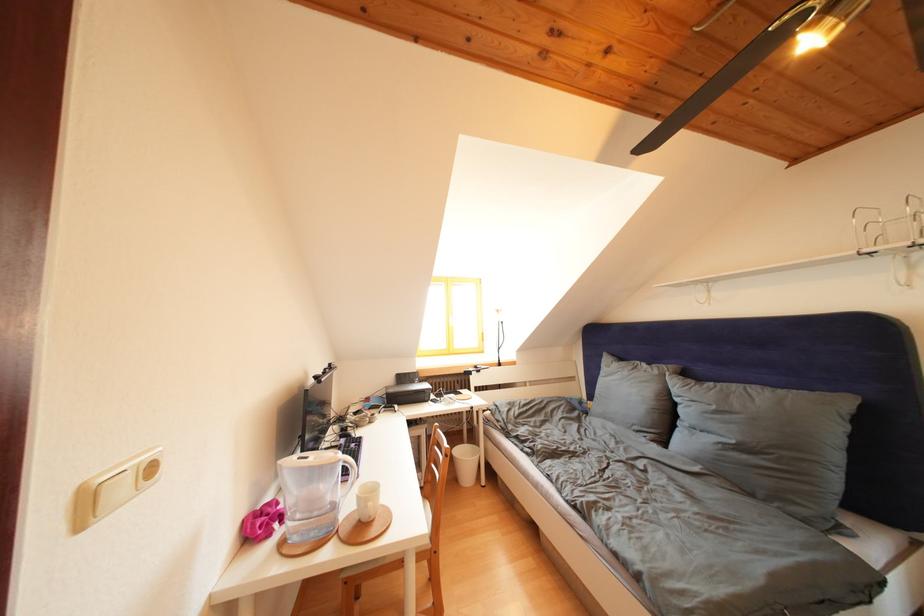
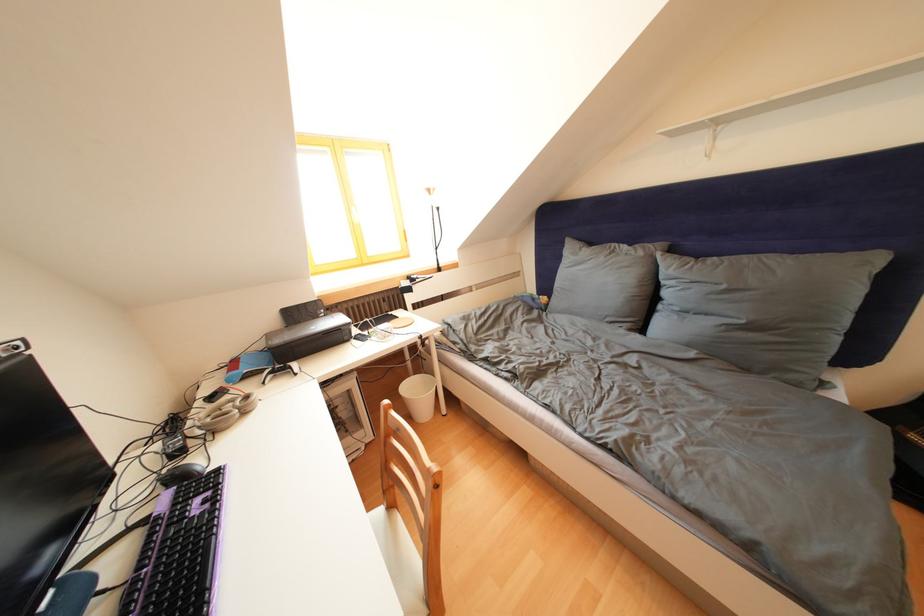
In the second image, find the point that corresponds to point (363, 419) in the first image.

(220, 403)